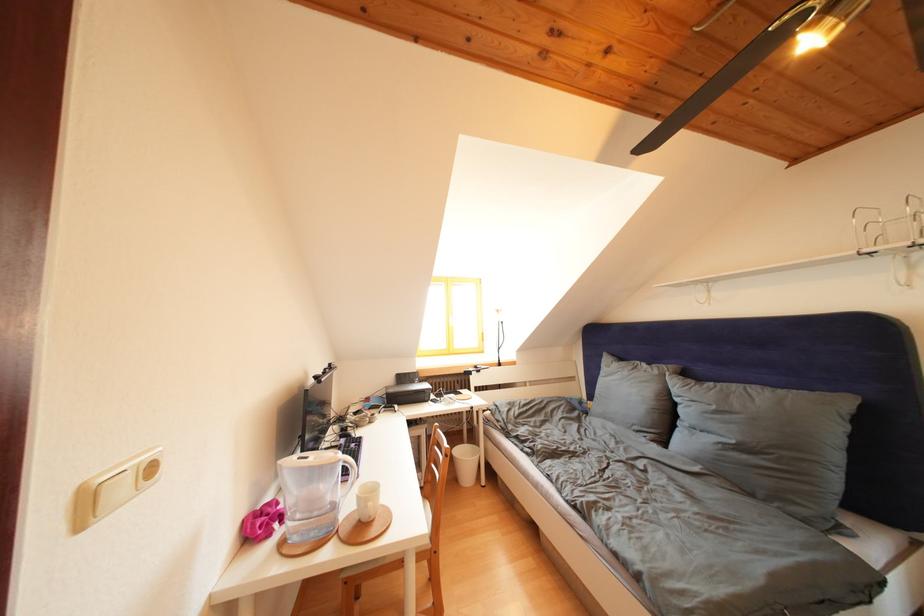
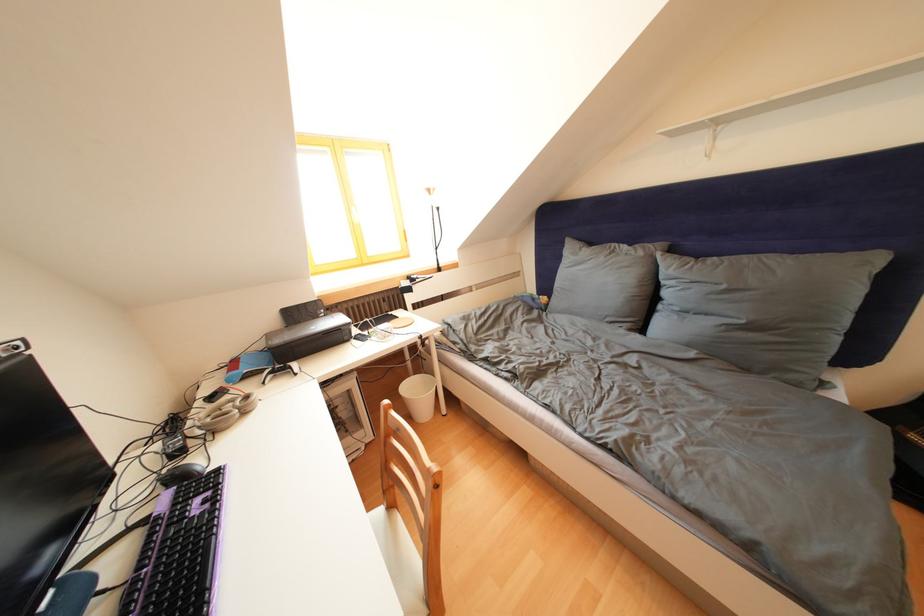
In the second image, find the point that corresponds to point (363, 419) in the first image.

(220, 403)